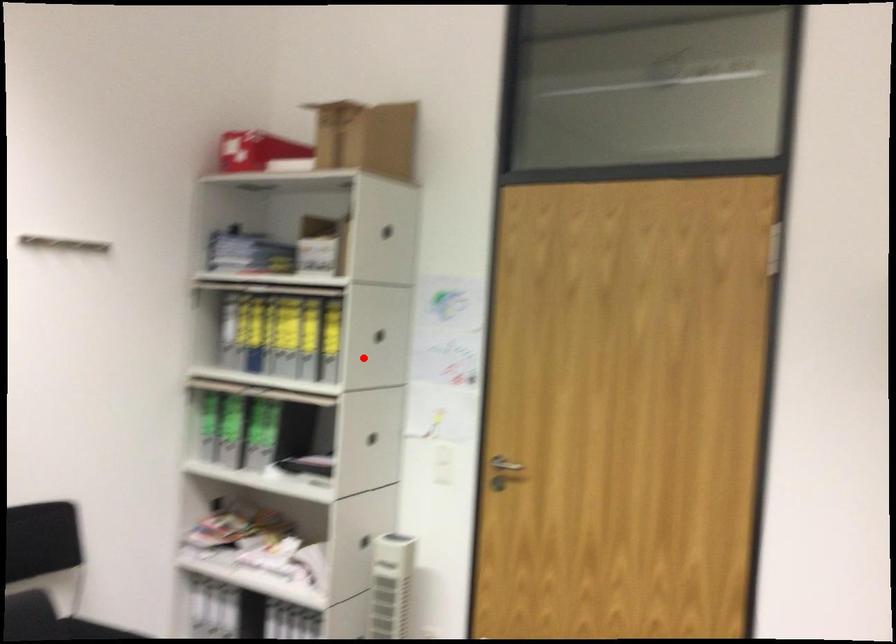
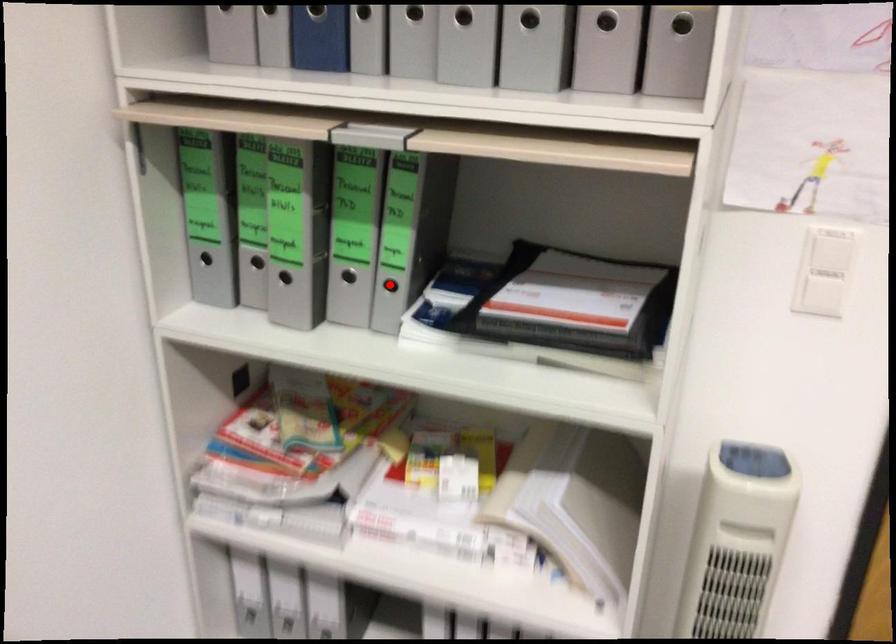
I am providing you with two images of the same scene from different viewpoints. A red point is marked on the first image and another point is marked on the second image. Is the marked point in image1 the same physical position as the marked point in image2?

No